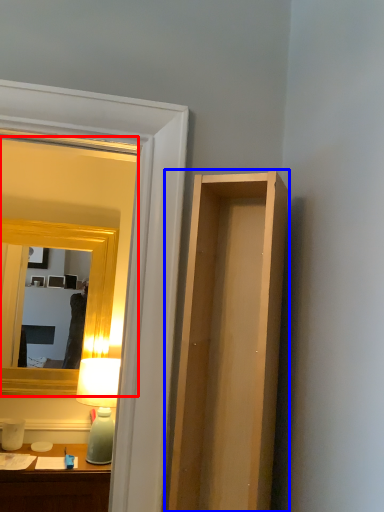
Question: Which point is further to the camera, mirror (highlighted by a red box) or cabinet (highlighted by a blue box)?

Choices:
 (A) mirror
 (B) cabinet

Answer: (A)